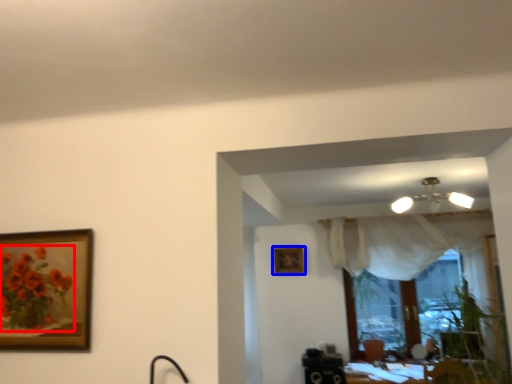
Question: Which object is further to the camera taking this photo, flower (highlighted by a red box) or picture frame (highlighted by a blue box)?

Choices:
 (A) flower
 (B) picture frame

Answer: (B)